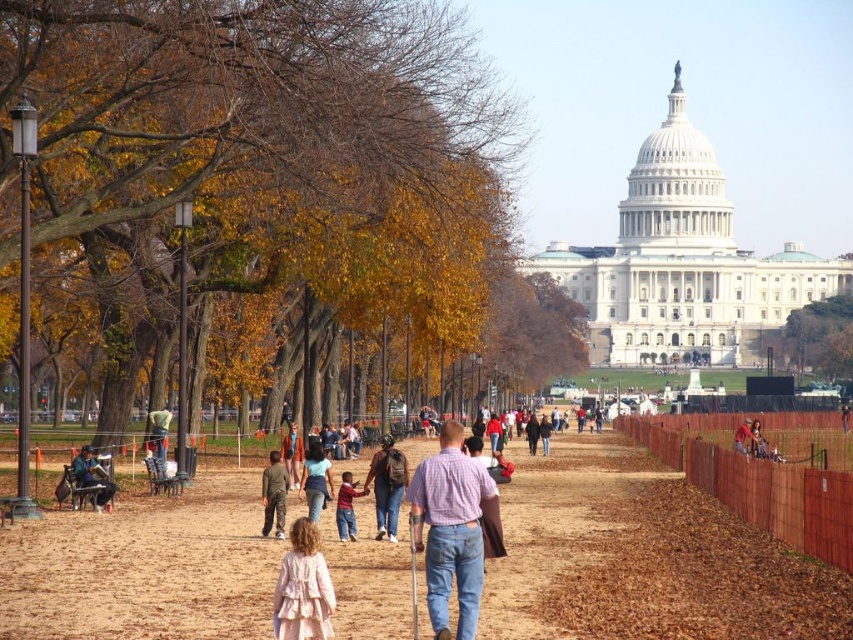
Question: Which of the following is the farthest from the observer?

Choices:
 (A) click(x=329, y=625)
 (B) click(x=834, y=356)
 (C) click(x=271, y=524)

Answer: (B)

Question: Does pastel pink fabric dress at lower center appear under khaki pants at center?

Choices:
 (A) no
 (B) yes

Answer: (B)

Question: Based on their relative distances, which object is nearer to the green leafy tree at center-right?

Choices:
 (A) yellow leaves at left
 (B) brown dirt path at center
 (C) khaki pants at center
 (D) plaid shirt at center

Answer: (B)

Question: Considering the real-world distances, which object is farthest from the denim jacket at center?

Choices:
 (A) pastel pink fabric dress at lower center
 (B) plaid shirt at center

Answer: (B)

Question: Is pastel pink fabric dress at lower center to the left of khaki pants at center from the viewer's perspective?

Choices:
 (A) no
 (B) yes

Answer: (A)

Question: Can you confirm if pastel pink fabric dress at lower center is positioned to the left of khaki pants at center?

Choices:
 (A) yes
 (B) no

Answer: (B)